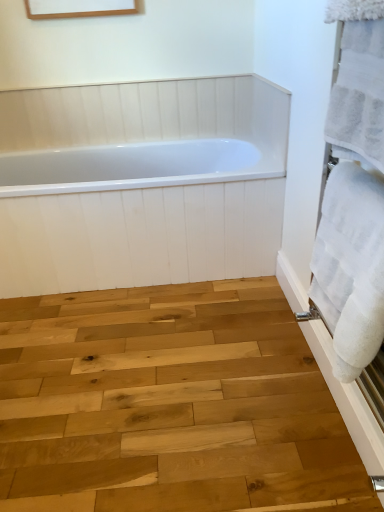
Question: From a real-world perspective, relative to white soft towel at right, which is the 2th bath towel from top to bottom, is white glossy bathtub at center vertically above or below?

Choices:
 (A) below
 (B) above

Answer: (A)

Question: From the image's perspective, is white glossy bathtub at center above or below white soft towel at right, which is the 2th bath towel from top to bottom?

Choices:
 (A) below
 (B) above

Answer: (B)

Question: Which object is positioned farthest from the white soft towel at right, arranged as the first bath towel when ordered from the bottom?

Choices:
 (A) white fluffy towel at right, the 2th bath towel positioned from the bottom
 (B) natural wood plank at center
 (C) white glossy bathtub at center

Answer: (C)

Question: Considering the real-world distances, which object is closest to the natural wood plank at center?

Choices:
 (A) white fluffy towel at right, which is counted as the first bath towel, starting from the top
 (B) white soft towel at right, arranged as the first bath towel when ordered from the bottom
 (C) white glossy bathtub at center

Answer: (B)